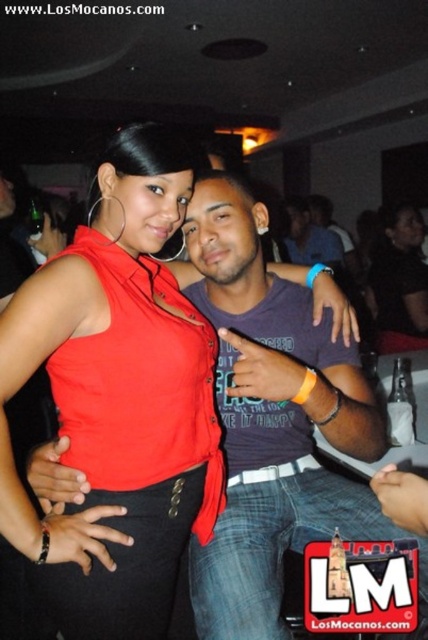
Which is more to the right, satin red top at center or matte purple shirt at center?

matte purple shirt at center

The height and width of the screenshot is (640, 428). I want to click on satin red top at center, so click(118, 401).

Looking at this image, can you confirm if satin red top at center is positioned above matte black top at center?

Actually, satin red top at center is below matte black top at center.

The width and height of the screenshot is (428, 640). Identify the location of satin red top at center. (118, 401).

Identify the location of satin red top at center. The height and width of the screenshot is (640, 428). (118, 401).

Is point (89, 269) farther from viewer compared to point (296, 237)?

No, (89, 269) is in front of (296, 237).

Image resolution: width=428 pixels, height=640 pixels. In order to click on satin red top at center in this screenshot , I will do `click(118, 401)`.